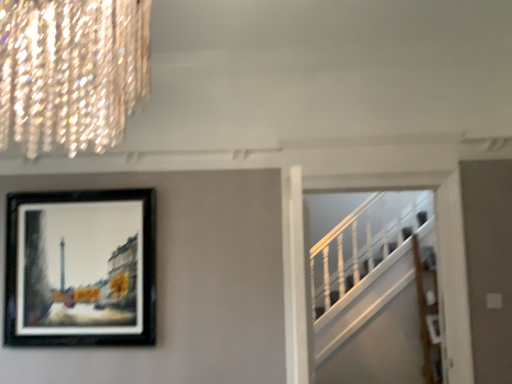
Measure the distance between point (x=109, y=4) and camera.

A distance of 28.27 inches exists between point (x=109, y=4) and camera.

The width and height of the screenshot is (512, 384). Find the location of `black matte picture frame at upper left`. black matte picture frame at upper left is located at coordinates (81, 268).

What do you see at coordinates (373, 291) in the screenshot? I see `white wooden stairs at right` at bounding box center [373, 291].

Identify the location of crystal glass chandelier at upper left. (72, 72).

Does black matte picture frame at upper left contain crystal glass chandelier at upper left?

No, crystal glass chandelier at upper left is located outside of black matte picture frame at upper left.

Could you tell me if black matte picture frame at upper left is turned towards crystal glass chandelier at upper left?

Yes, black matte picture frame at upper left is aimed at crystal glass chandelier at upper left.

From a real-world perspective, is black matte picture frame at upper left physically above crystal glass chandelier at upper left?

No, from a real-world perspective, black matte picture frame at upper left is not on top of crystal glass chandelier at upper left.

From the image's perspective, is white wooden stairs at right on black matte picture frame at upper left?

No, from the image's perspective, white wooden stairs at right is not over black matte picture frame at upper left.

Is white wooden stairs at right aimed at black matte picture frame at upper left?

No, white wooden stairs at right is not aimed at black matte picture frame at upper left.

Is white wooden stairs at right with black matte picture frame at upper left?

There is a gap between white wooden stairs at right and black matte picture frame at upper left.

Is white wooden stairs at right bigger than black matte picture frame at upper left?

Indeed, white wooden stairs at right has a larger size compared to black matte picture frame at upper left.

Is black matte picture frame at upper left not inside white wooden stairs at right?

That's correct, black matte picture frame at upper left is outside of white wooden stairs at right.

Find the location of `escalator that is on the right side of black matte picture frame at upper left`. escalator that is on the right side of black matte picture frame at upper left is located at coordinates (373, 291).

Is black matte picture frame at upper left positioned with its back to white wooden stairs at right?

No, black matte picture frame at upper left's orientation is not away from white wooden stairs at right.

Is crystal glass chandelier at upper left next to white wooden stairs at right?

No, crystal glass chandelier at upper left is not next to white wooden stairs at right.

Who is smaller, crystal glass chandelier at upper left or white wooden stairs at right?

white wooden stairs at right.

In the image, is crystal glass chandelier at upper left positioned in front of or behind white wooden stairs at right?

Visually, crystal glass chandelier at upper left is located in front of white wooden stairs at right.

Visually, is crystal glass chandelier at upper left positioned to the left or to the right of white wooden stairs at right?

In the image, crystal glass chandelier at upper left appears on the left side of white wooden stairs at right.

Is crystal glass chandelier at upper left facing away from black matte picture frame at upper left?

No, crystal glass chandelier at upper left is not facing away from black matte picture frame at upper left.

Considering the positions of objects crystal glass chandelier at upper left and black matte picture frame at upper left in the image provided, who is more to the right, crystal glass chandelier at upper left or black matte picture frame at upper left?

crystal glass chandelier at upper left.

Can you confirm if crystal glass chandelier at upper left is shorter than black matte picture frame at upper left?

Yes, crystal glass chandelier at upper left is shorter than black matte picture frame at upper left.

Who is smaller, crystal glass chandelier at upper left or black matte picture frame at upper left?

Smaller between the two is black matte picture frame at upper left.

From a real-world perspective, who is located higher, white wooden stairs at right or crystal glass chandelier at upper left?

crystal glass chandelier at upper left is physically above.

Is white wooden stairs at right shorter than crystal glass chandelier at upper left?

In fact, white wooden stairs at right may be taller than crystal glass chandelier at upper left.

Choose the correct answer: Is white wooden stairs at right inside crystal glass chandelier at upper left or outside it?

white wooden stairs at right lies outside crystal glass chandelier at upper left.

Identify the location of picture frame below the crystal glass chandelier at upper left (from the image's perspective). The height and width of the screenshot is (384, 512). (81, 268).

Find the location of a particular element. Image resolution: width=512 pixels, height=384 pixels. escalator on the right of black matte picture frame at upper left is located at coordinates (373, 291).

Looking at the image, which one is located further to white wooden stairs at right, crystal glass chandelier at upper left or black matte picture frame at upper left?

The object further to white wooden stairs at right is crystal glass chandelier at upper left.

Looking at the image, which one is located further to black matte picture frame at upper left, crystal glass chandelier at upper left or white wooden stairs at right?

Based on the image, white wooden stairs at right appears to be further to black matte picture frame at upper left.

When comparing their distances from crystal glass chandelier at upper left, does black matte picture frame at upper left or white wooden stairs at right seem closer?

Among the two, black matte picture frame at upper left is located nearer to crystal glass chandelier at upper left.

Based on their spatial positions, is white wooden stairs at right or crystal glass chandelier at upper left closer to black matte picture frame at upper left?

crystal glass chandelier at upper left is closer to black matte picture frame at upper left.

Consider the image. Which object lies nearer to the anchor point crystal glass chandelier at upper left, white wooden stairs at right or black matte picture frame at upper left?

black matte picture frame at upper left is positioned closer to the anchor crystal glass chandelier at upper left.

When comparing their distances from white wooden stairs at right, does black matte picture frame at upper left or crystal glass chandelier at upper left seem further?

crystal glass chandelier at upper left.

Locate an element on the screen. The width and height of the screenshot is (512, 384). escalator located between crystal glass chandelier at upper left and black matte picture frame at upper left in the depth direction is located at coordinates (373, 291).